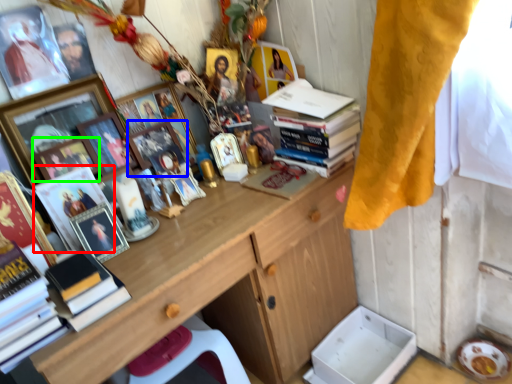
Question: Which is nearer to the magazine (highlighted by a red box)? picture frame (highlighted by a blue box) or picture frame (highlighted by a green box).

Choices:
 (A) picture frame
 (B) picture frame

Answer: (B)